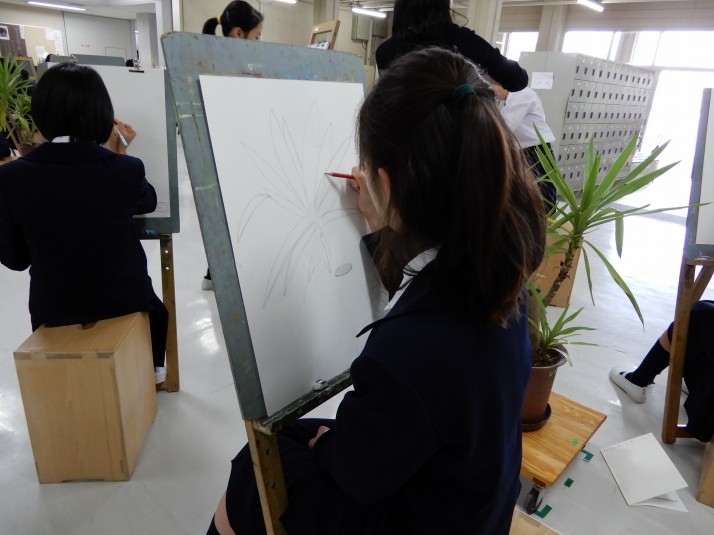
Locate an element on the screen. The width and height of the screenshot is (714, 535). seat is located at coordinates click(x=65, y=386), click(x=552, y=266).